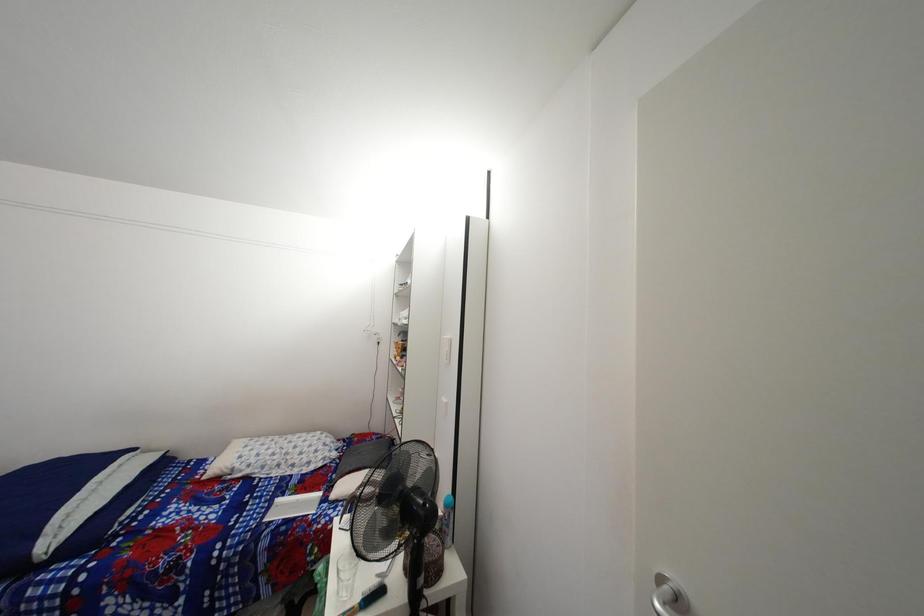
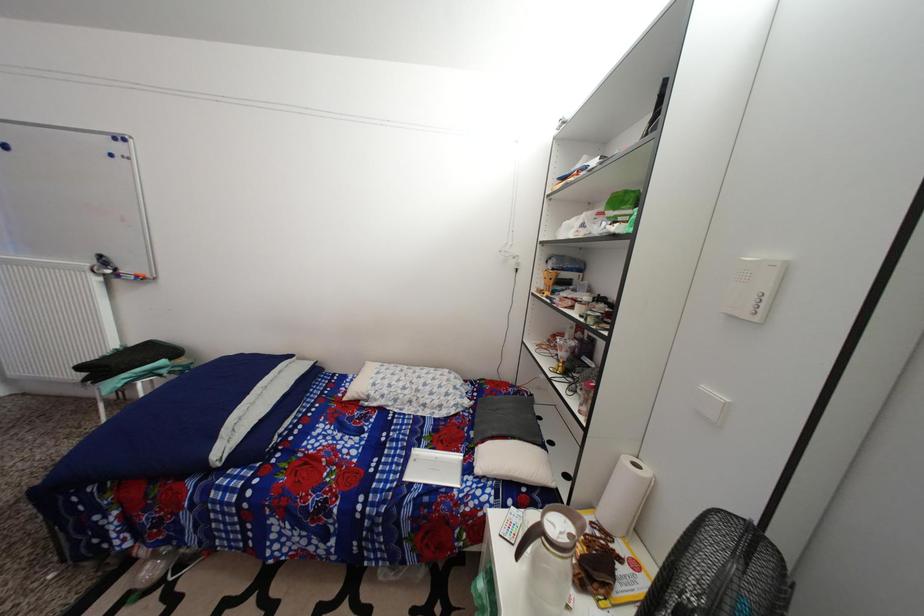
Based on the continuous images, in which direction is the camera rotating?

The camera rotated toward left-down.